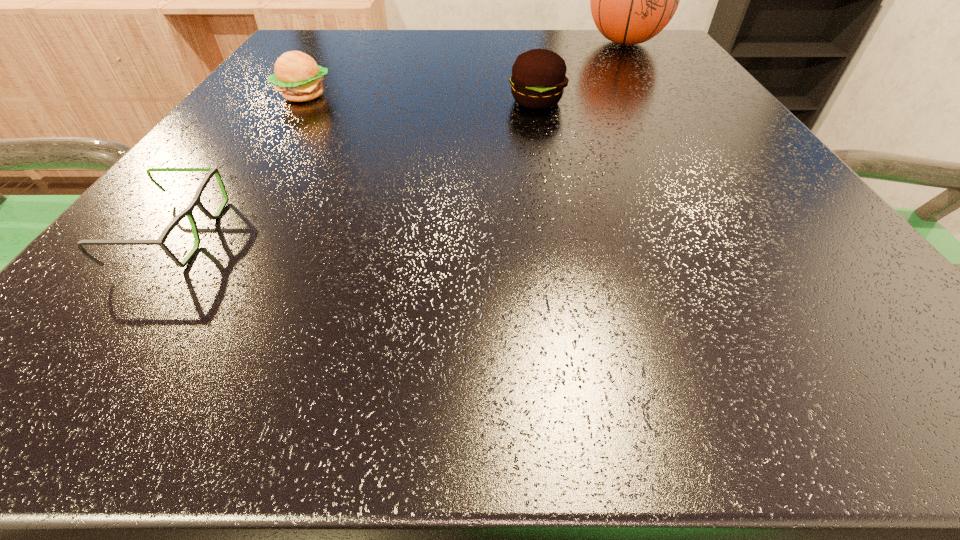
You are a GUI agent. You are given a task and a screenshot of the screen. Output one action in this format:
    pyautogui.click(x=<x>, y=<y>)
    Task: Click on the farthest object
    Image resolution: width=960 pixels, height=540 pixels.
    Given the screenshot: What is the action you would take?
    pyautogui.click(x=632, y=0)

You are a GUI agent. You are given a task and a screenshot of the screen. Output one action in this format:
    pyautogui.click(x=<x>, y=<y>)
    Task: Click on the tallest object
    This screenshot has height=540, width=960.
    Given the screenshot: What is the action you would take?
    pyautogui.click(x=632, y=0)

The width and height of the screenshot is (960, 540). Identify the location of the second object from right to left. point(538,78).

Locate an element on the screen. Image resolution: width=960 pixels, height=540 pixels. hamburger is located at coordinates (298, 77).

You are a GUI agent. You are given a task and a screenshot of the screen. Output one action in this format:
    pyautogui.click(x=<x>, y=<y>)
    Task: Click on the nearest object
    The width and height of the screenshot is (960, 540).
    Given the screenshot: What is the action you would take?
    pyautogui.click(x=196, y=201)

I want to click on spectacles, so tap(196, 201).

Where is `vacant point located on the front of the farthest object`? The height and width of the screenshot is (540, 960). vacant point located on the front of the farthest object is located at coordinates (688, 140).

Where is `vacant space located 0.200m on the left of the third object from left to right`? The image size is (960, 540). vacant space located 0.200m on the left of the third object from left to right is located at coordinates (391, 102).

I want to click on vacant position located 0.080m on the front of the hamburger, so click(280, 132).

Where is `free space located on the lens of the nearest object`? This screenshot has height=540, width=960. free space located on the lens of the nearest object is located at coordinates (484, 233).